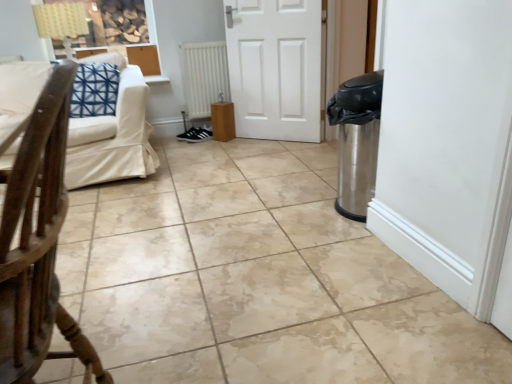
Describe the element at coordinates (112, 135) in the screenshot. This screenshot has width=512, height=384. I see `beige fabric couch at upper left` at that location.

What do you see at coordinates (195, 135) in the screenshot? I see `black suede sneakers at center` at bounding box center [195, 135].

Locate an element on the screen. wooden chair at left is located at coordinates (38, 242).

Identify the location of beige fabric couch at upper left. Image resolution: width=512 pixels, height=384 pixels. (112, 135).

From a real-world perspective, which object stands above the other?

In real-world perspective, wooden chair at left is above.

Who is taller, white matte radiator at center or wooden chair at left?

Standing taller between the two is wooden chair at left.

Which of these two, white matte radiator at center or wooden chair at left, is wider?

wooden chair at left is wider.

From the picture: Is white matte radiator at center aimed at wooden chair at left?

Yes, white matte radiator at center is oriented towards wooden chair at left.

Is point (182, 135) closer to viewer compared to point (194, 64)?

No.

Which of these two, black suede sneakers at center or white matte radiator at center, is wider?

With larger width is black suede sneakers at center.

From the image's perspective, is black suede sneakers at center located above or below white matte radiator at center?

From the image's perspective, black suede sneakers at center appears below white matte radiator at center.

Could you tell me if black suede sneakers at center is turned towards white matte radiator at center?

Yes, black suede sneakers at center is aimed at white matte radiator at center.

Is wooden chair at left bigger than beige fabric couch at upper left?

Actually, wooden chair at left might be smaller than beige fabric couch at upper left.

Considering the sizes of wooden chair at left and beige fabric couch at upper left in the image, is wooden chair at left taller or shorter than beige fabric couch at upper left?

Considering their sizes, wooden chair at left has more height than beige fabric couch at upper left.

Considering the positions of objects wooden chair at left and beige fabric couch at upper left in the image provided, who is more to the left, wooden chair at left or beige fabric couch at upper left?

beige fabric couch at upper left.

From a real-world perspective, is wooden chair at left physically located above or below beige fabric couch at upper left?

wooden chair at left is above beige fabric couch at upper left.

What's the angular difference between beige fabric couch at upper left and black suede sneakers at center's facing directions?

The angular difference between beige fabric couch at upper left and black suede sneakers at center is 78.8 degrees.

Which is more to the left, beige fabric couch at upper left or black suede sneakers at center?

beige fabric couch at upper left is more to the left.

In order to click on studio couch in front of the black suede sneakers at center in this screenshot , I will do `click(112, 135)`.

Considering the sizes of objects beige fabric couch at upper left and black suede sneakers at center in the image provided, who is wider, beige fabric couch at upper left or black suede sneakers at center?

Wider between the two is beige fabric couch at upper left.

Is black suede sneakers at center positioned beyond the bounds of beige fabric couch at upper left?

black suede sneakers at center is positioned outside beige fabric couch at upper left.

Locate an element on the screen. The height and width of the screenshot is (384, 512). footwear that is behind the beige fabric couch at upper left is located at coordinates (195, 135).

Can you confirm if black suede sneakers at center is thinner than beige fabric couch at upper left?

Yes.

Does black suede sneakers at center lie in front of beige fabric couch at upper left?

No, the depth of black suede sneakers at center is greater than that of beige fabric couch at upper left.

From the image's perspective, is white matte radiator at center below black suede sneakers at center?

Incorrect, from the image's perspective, white matte radiator at center is higher than black suede sneakers at center.

Considering the sizes of white matte radiator at center and black suede sneakers at center in the image, is white matte radiator at center bigger or smaller than black suede sneakers at center?

Considering their sizes, white matte radiator at center takes up more space than black suede sneakers at center.

Is point (219, 44) farther from camera compared to point (188, 130)?

No, (219, 44) is in front of (188, 130).

How many degrees apart are the facing directions of wooden chair at left and black suede sneakers at center?

The angular difference between wooden chair at left and black suede sneakers at center is 9.81 degrees.

Is wooden chair at left with black suede sneakers at center?

No, wooden chair at left is not with black suede sneakers at center.

Is wooden chair at left outside of black suede sneakers at center?

That's correct, wooden chair at left is outside of black suede sneakers at center.

Is point (40, 148) closer or farther from the camera than point (198, 128)?

Point (40, 148) is closer to the camera than point (198, 128).

You are a GUI agent. You are given a task and a screenshot of the screen. Output one action in this format:
    pyautogui.click(x=<x>, y=<y>)
    Task: Click on the radiator that appears below the wooden chair at left (from a real-world perspective)
    
    Given the screenshot: What is the action you would take?
    pyautogui.click(x=204, y=76)

In the image, there is a white matte radiator at center. Where is `footwear below it (from the image's perspective)`? footwear below it (from the image's perspective) is located at coordinates (195, 135).

Estimate the real-world distances between objects in this image. Which object is further from wooden chair at left, white matte radiator at center or black suede sneakers at center?

black suede sneakers at center is positioned further to the anchor wooden chair at left.

Considering their positions, is black suede sneakers at center positioned further to beige fabric couch at upper left than white matte radiator at center?

black suede sneakers at center is further to beige fabric couch at upper left.

Estimate the real-world distances between objects in this image. Which object is closer to black suede sneakers at center, white matte radiator at center or beige fabric couch at upper left?

white matte radiator at center is positioned closer to the anchor black suede sneakers at center.

Estimate the real-world distances between objects in this image. Which object is further from beige fabric couch at upper left, wooden chair at left or black suede sneakers at center?

wooden chair at left is further to beige fabric couch at upper left.

Considering their positions, is white matte radiator at center positioned closer to beige fabric couch at upper left than black suede sneakers at center?

white matte radiator at center is positioned closer to the anchor beige fabric couch at upper left.

Estimate the real-world distances between objects in this image. Which object is closer to black suede sneakers at center, white matte radiator at center or wooden chair at left?

Based on the image, white matte radiator at center appears to be nearer to black suede sneakers at center.

From the image, which object appears to be nearer to white matte radiator at center, wooden chair at left or beige fabric couch at upper left?

beige fabric couch at upper left lies closer to white matte radiator at center than the other object.

From the image, which object appears to be nearer to beige fabric couch at upper left, black suede sneakers at center or wooden chair at left?

The object closer to beige fabric couch at upper left is black suede sneakers at center.

The image size is (512, 384). I want to click on radiator between wooden chair at left and black suede sneakers at center along the z-axis, so click(204, 76).

Locate an element on the screen. Image resolution: width=512 pixels, height=384 pixels. studio couch located between wooden chair at left and black suede sneakers at center in the depth direction is located at coordinates (112, 135).

Find the location of a particular element. radiator between beige fabric couch at upper left and black suede sneakers at center from front to back is located at coordinates [204, 76].

Locate an element on the screen. The image size is (512, 384). studio couch between wooden chair at left and white matte radiator at center along the z-axis is located at coordinates (112, 135).